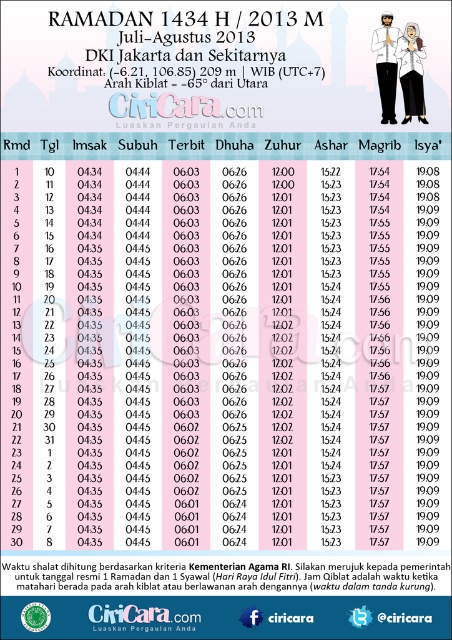
You are designing a layout for a Ramadan calendar and want to place the title text between the white cotton shirt at upper right and the matte white shirt at center. Is there enough space between them to fit the title text?

The white cotton shirt at upper right is 0.94 inches away from the matte white shirt at center. Since the title text requires more space than 0.94 inches, it won t fit between them.

You are organizing a clothing donation drive and have two shirts to place on a rack. The white cotton shirt at upper right and the matte white shirt at center. Which shirt should you place higher on the rack to ensure both are visible?

The white cotton shirt at upper right should be placed higher since it is shorter than the matte white shirt at center, allowing both to be visible without one blocking the other.